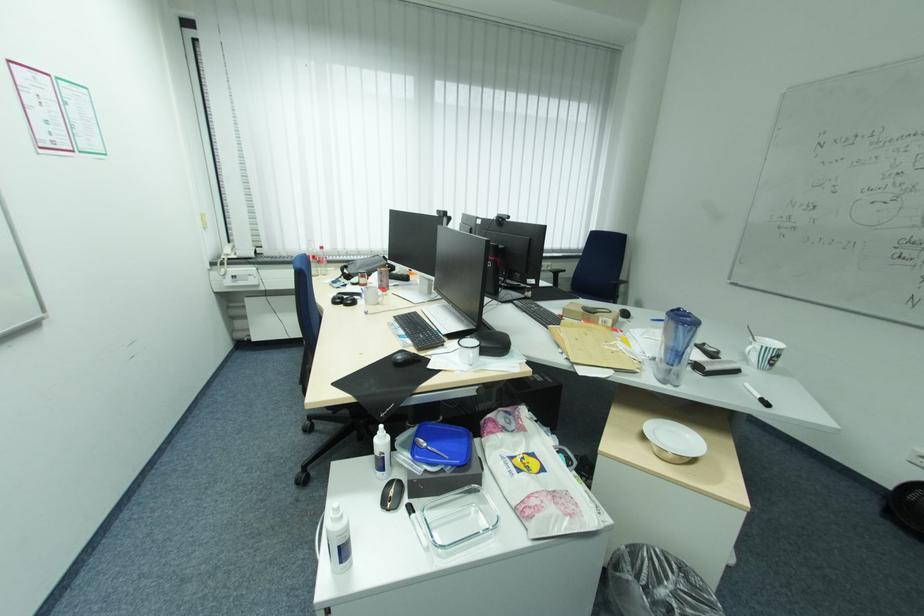
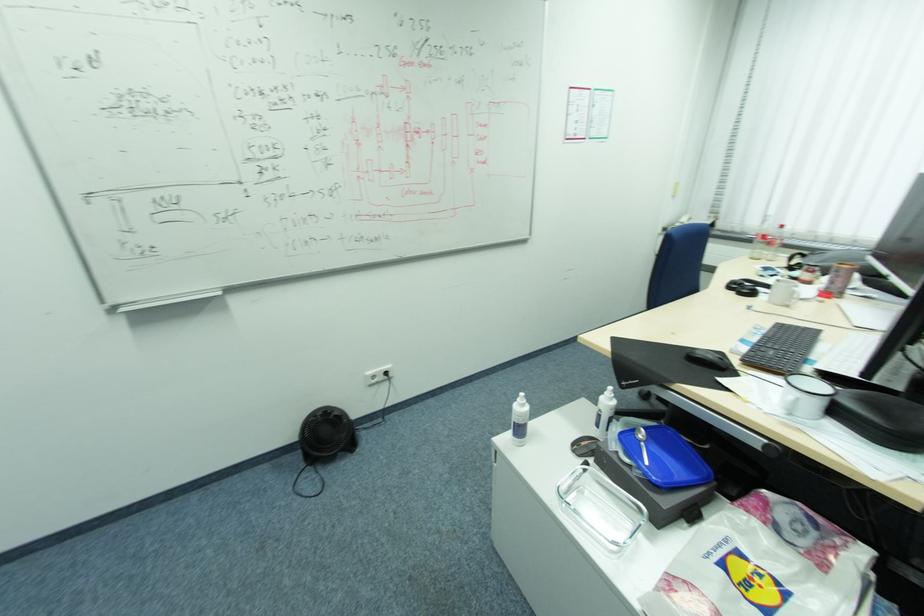
Find the pixel in the second image that matches pixel 432 471 in the first image.

(624, 453)